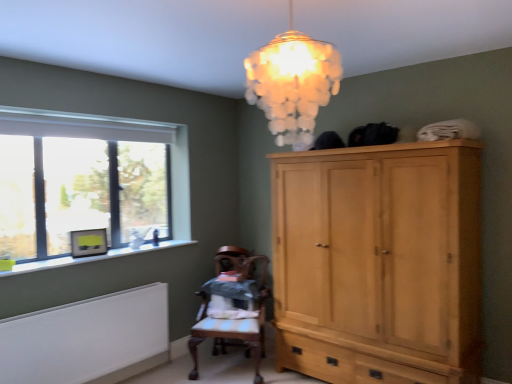
Question: Is wooden chair at center wider than white painted radiator at lower left?

Choices:
 (A) yes
 (B) no

Answer: (A)

Question: Is wooden chair at center next to white painted radiator at lower left and touching it?

Choices:
 (A) no
 (B) yes

Answer: (A)

Question: Is wooden chair at center positioned beyond the bounds of white painted radiator at lower left?

Choices:
 (A) no
 (B) yes

Answer: (B)

Question: Does wooden chair at center contain white painted radiator at lower left?

Choices:
 (A) no
 (B) yes

Answer: (A)

Question: Can you confirm if wooden chair at center is smaller than white painted radiator at lower left?

Choices:
 (A) yes
 (B) no

Answer: (B)

Question: In the image, is translucent glass chandelier at upper center positioned in front of or behind wooden chair at center?

Choices:
 (A) front
 (B) behind

Answer: (A)

Question: From a real-world perspective, is translucent glass chandelier at upper center positioned above or below wooden chair at center?

Choices:
 (A) below
 (B) above

Answer: (B)

Question: From their relative heights in the image, would you say translucent glass chandelier at upper center is taller or shorter than wooden chair at center?

Choices:
 (A) tall
 (B) short

Answer: (B)

Question: In the image, is translucent glass chandelier at upper center on the left side or the right side of wooden chair at center?

Choices:
 (A) left
 (B) right

Answer: (B)

Question: From a real-world perspective, is translucent glass chandelier at upper center positioned above or below white painted radiator at lower left?

Choices:
 (A) above
 (B) below

Answer: (A)

Question: Considering the positions of translucent glass chandelier at upper center and white painted radiator at lower left in the image, is translucent glass chandelier at upper center bigger or smaller than white painted radiator at lower left?

Choices:
 (A) big
 (B) small

Answer: (B)

Question: Is translucent glass chandelier at upper center in front of or behind white painted radiator at lower left in the image?

Choices:
 (A) behind
 (B) front

Answer: (B)

Question: Is translucent glass chandelier at upper center taller or shorter than white painted radiator at lower left?

Choices:
 (A) tall
 (B) short

Answer: (B)

Question: Is point (349, 337) closer or farther from the camera than point (294, 81)?

Choices:
 (A) farther
 (B) closer

Answer: (A)

Question: Considering the positions of light wood cabinet at right and translucent glass chandelier at upper center in the image, is light wood cabinet at right wider or thinner than translucent glass chandelier at upper center?

Choices:
 (A) thin
 (B) wide

Answer: (B)